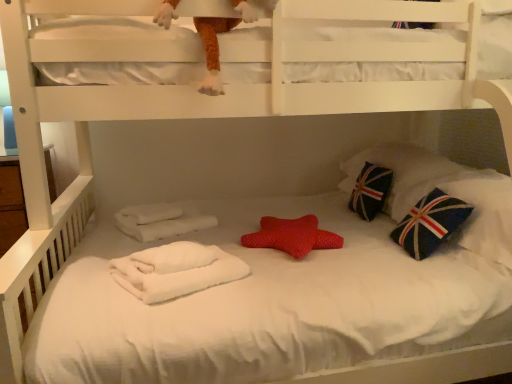
Find the location of a particular element. This screenshot has width=512, height=384. free point above white fluffy towel at lower left (from a real-world perspective) is located at coordinates (175, 263).